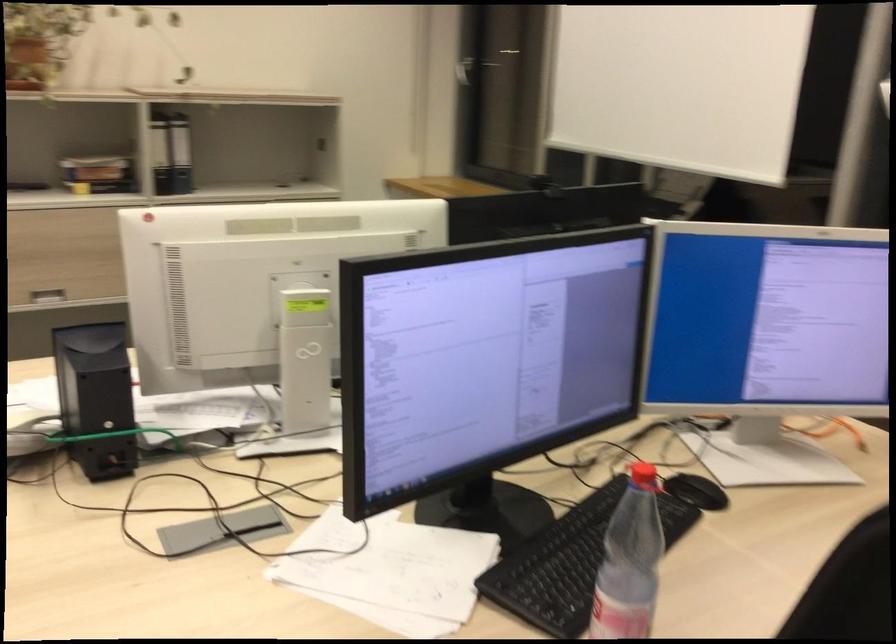
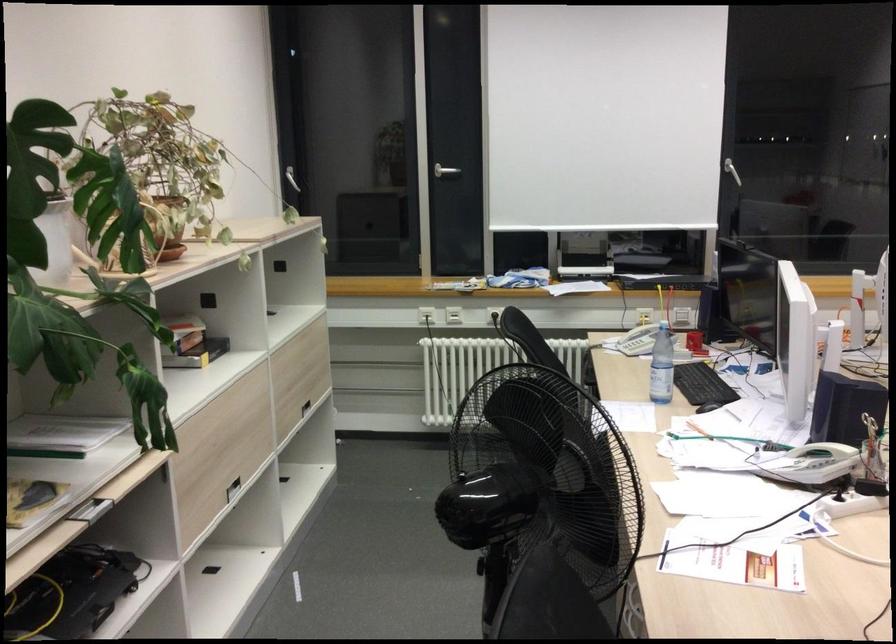
Where in the second image is the point corresponding to (x=82, y=418) from the first image?

(814, 464)